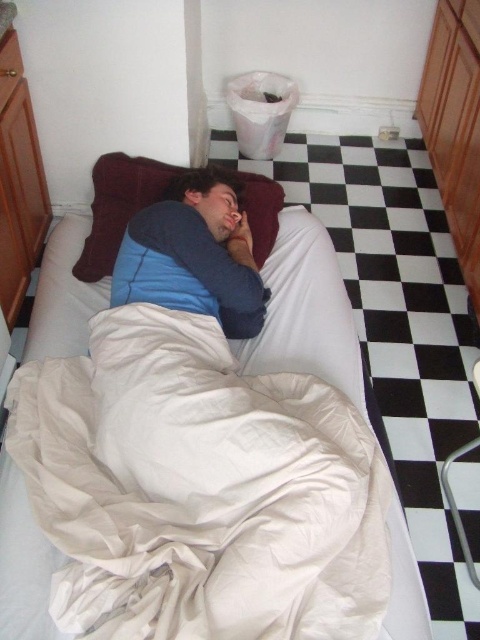
You are a delivery robot with a width of 16 inches. You need to navigate through the space between the white cotton bed at center and the matte blue pillow at center. Can you fit through this space?

The distance between the white cotton bed at center and the matte blue pillow at center is 17.24 inches. Since the robot is 16 inches wide, it can fit through the space as there is enough clearance.